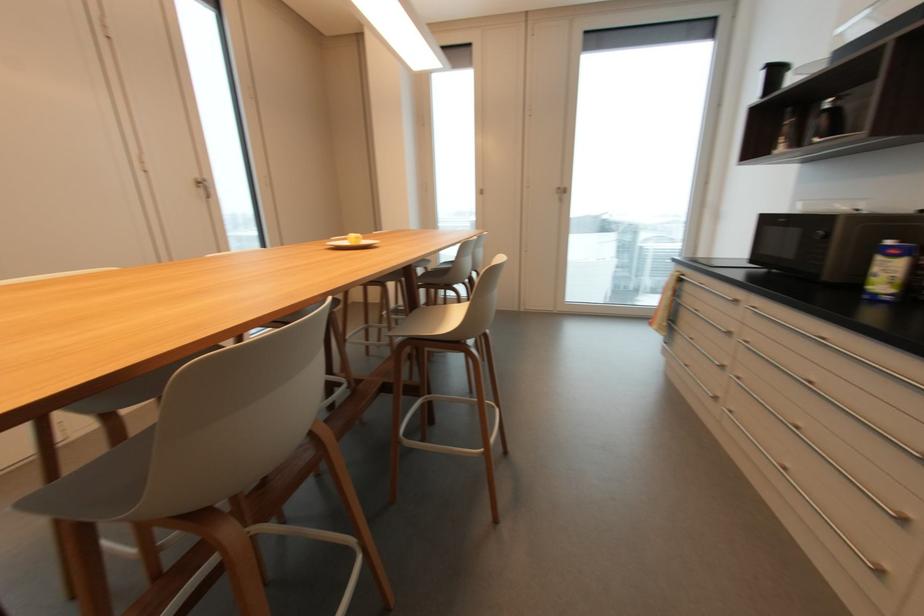
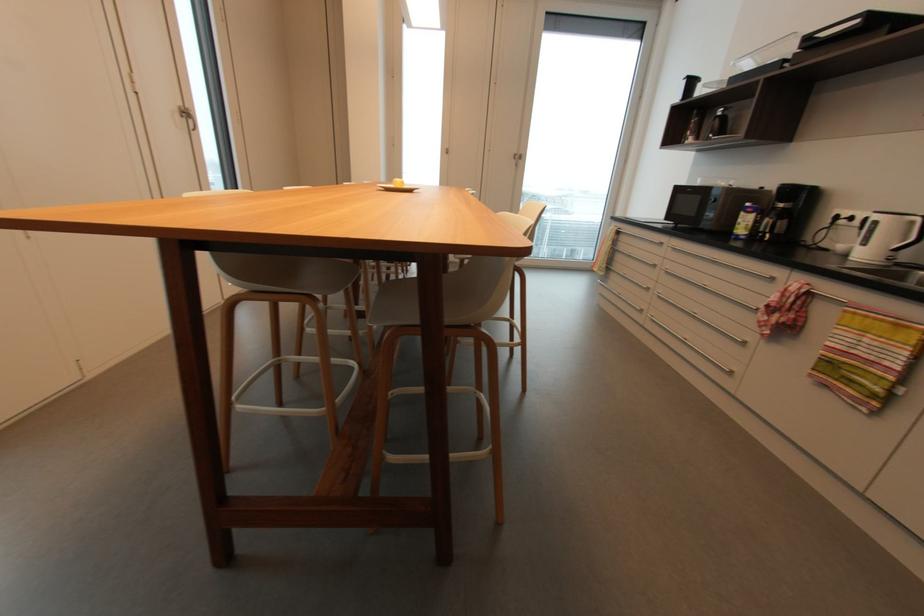
Which direction would the cameraman need to move to produce the second image?

The cameraman moved toward left, backward.